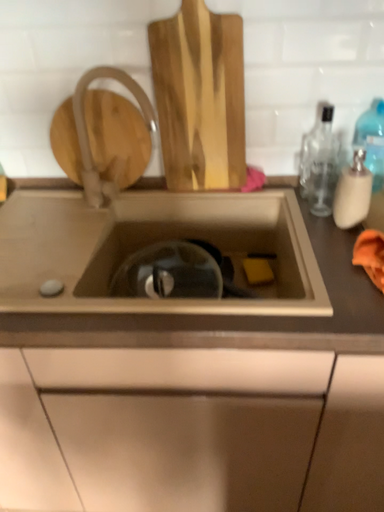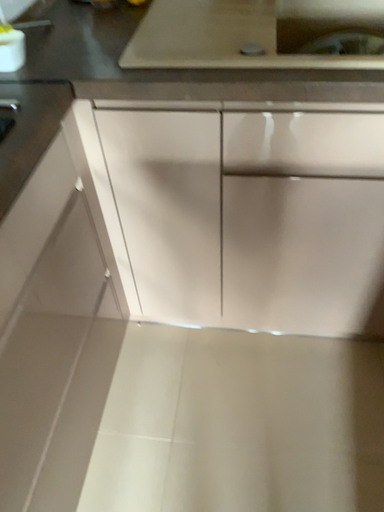
Question: Which way did the camera rotate in the video?

Choices:
 (A) rotated downward
 (B) rotated upward

Answer: (A)